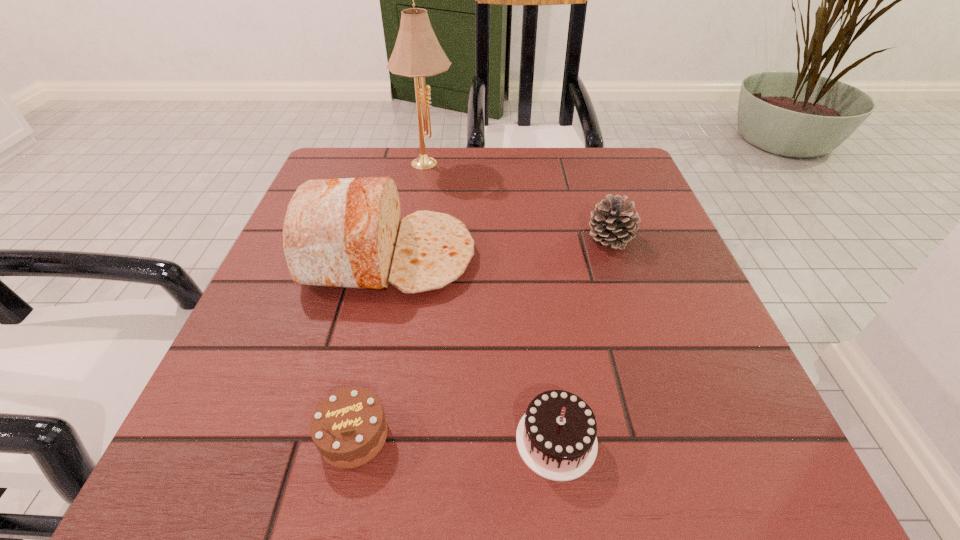
Locate an element on the screen. free space located at the sliced end of the bread is located at coordinates (527, 256).

You are a GUI agent. You are given a task and a screenshot of the screen. Output one action in this format:
    pyautogui.click(x=<x>, y=<y>)
    Task: Click on the free space located on the left of the rightmost object
    The width and height of the screenshot is (960, 540).
    Given the screenshot: What is the action you would take?
    pyautogui.click(x=511, y=238)

You are a GUI agent. You are given a task and a screenshot of the screen. Output one action in this format:
    pyautogui.click(x=<x>, y=<y>)
    Task: Click on the free spot located 0.240m on the back of the second object from right to left
    The height and width of the screenshot is (540, 960).
    Given the screenshot: What is the action you would take?
    point(536,282)

Where is `vacant space located 0.140m on the back of the left chocolate cake`? vacant space located 0.140m on the back of the left chocolate cake is located at coordinates (377, 327).

This screenshot has width=960, height=540. Identify the location of object located at the far edge. (417, 53).

The height and width of the screenshot is (540, 960). Find the location of `object that is at the left edge`. object that is at the left edge is located at coordinates (344, 233).

Where is `object situated at the right edge`? The height and width of the screenshot is (540, 960). object situated at the right edge is located at coordinates [x=613, y=223].

You are a GUI agent. You are given a task and a screenshot of the screen. Output one action in this format:
    pyautogui.click(x=<x>, y=<y>)
    Task: Click on the vacant space at the far edge of the desktop
    This screenshot has height=540, width=960.
    Given the screenshot: What is the action you would take?
    pyautogui.click(x=498, y=176)

Where is `vacant space at the near edge of the desktop`? vacant space at the near edge of the desktop is located at coordinates (365, 484).

Image resolution: width=960 pixels, height=540 pixels. Identify the location of free spot at the left edge of the desktop. (331, 341).